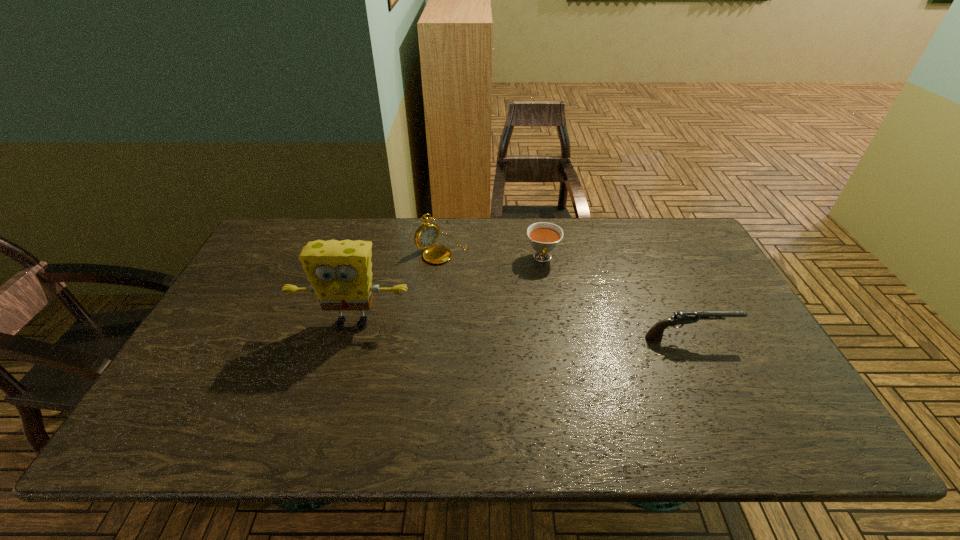
Locate an element on the screen. free space between the gun and the second object from right to left is located at coordinates (616, 298).

You are a GUI agent. You are given a task and a screenshot of the screen. Output one action in this format:
    pyautogui.click(x=<x>, y=<y>)
    Task: Click on the object identified as the third closest to the tallest object
    
    Given the screenshot: What is the action you would take?
    pyautogui.click(x=655, y=333)

I want to click on the closest object to the gun, so click(544, 237).

Where is `vacant space that satisfies the following two spatial constraints: 1. on the face of the gun; 2. aiming along the barrel of the tallest object`? vacant space that satisfies the following two spatial constraints: 1. on the face of the gun; 2. aiming along the barrel of the tallest object is located at coordinates (348, 338).

Find the location of a particular element. The image size is (960, 540). blank space that satisfies the following two spatial constraints: 1. on the front side of the pocket watch; 2. on the right side of the teacup is located at coordinates (441, 258).

You are a GUI agent. You are given a task and a screenshot of the screen. Output one action in this format:
    pyautogui.click(x=<x>, y=<y>)
    Task: Click on the vacant area in the image that satisfies the following two spatial constraints: 1. on the face of the sponge; 2. aiming along the barrel of the gun
    The image size is (960, 540).
    Given the screenshot: What is the action you would take?
    point(348,338)

At what (x,y) coordinates should I click in order to perform the action: click on vacant space that satisfies the following two spatial constraints: 1. on the front side of the rightmost object; 2. aiming along the barrel of the third shortest object. Please return your answer as a coordinate pair (x, y). The height and width of the screenshot is (540, 960). Looking at the image, I should click on (432, 338).